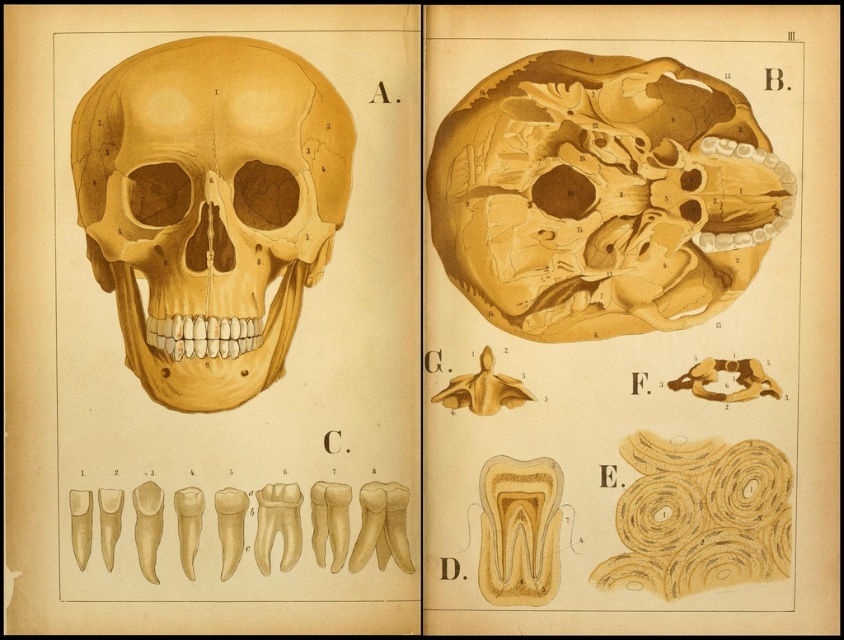
Question: Does matte yellow skull at upper right come in front of matte yellow skull at center?

Choices:
 (A) yes
 (B) no

Answer: (B)

Question: Can you confirm if matte yellow skull at upper right is positioned above matte yellow skull at center?

Choices:
 (A) no
 (B) yes

Answer: (B)

Question: Which object is closer to the camera taking this photo?

Choices:
 (A) matte yellow skull at center
 (B) matte yellow skull at upper right

Answer: (A)

Question: Is matte yellow skull at upper right thinner than matte yellow skull at center?

Choices:
 (A) no
 (B) yes

Answer: (A)